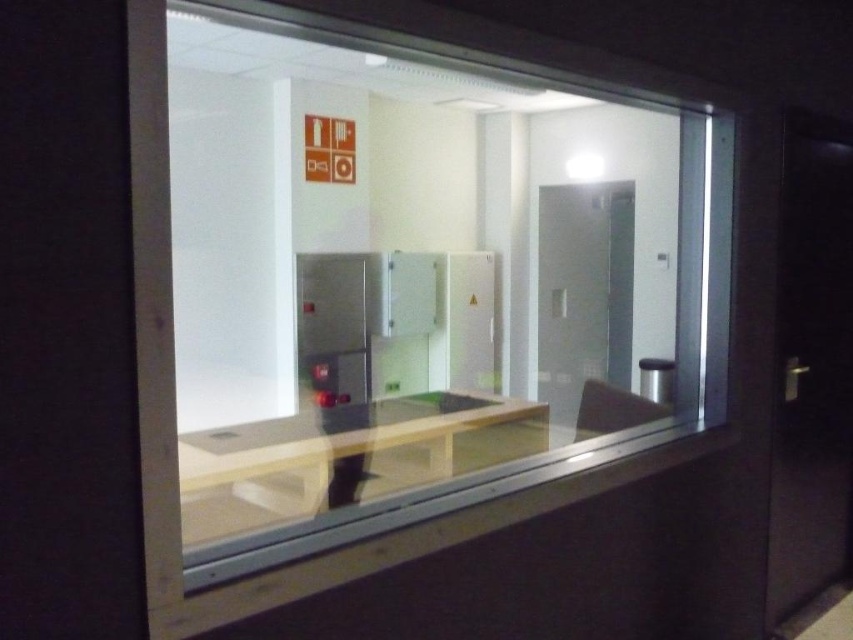
Which of these two, transparent glass window at center or transparent glass elevator at center, stands shorter?

With less height is transparent glass elevator at center.

Consider the image. Who is taller, transparent glass window at center or transparent glass elevator at center?

With more height is transparent glass window at center.

Which is behind, point (486, 253) or point (549, 333)?

Positioned behind is point (486, 253).

The image size is (853, 640). I want to click on transparent glass window at center, so click(x=416, y=278).